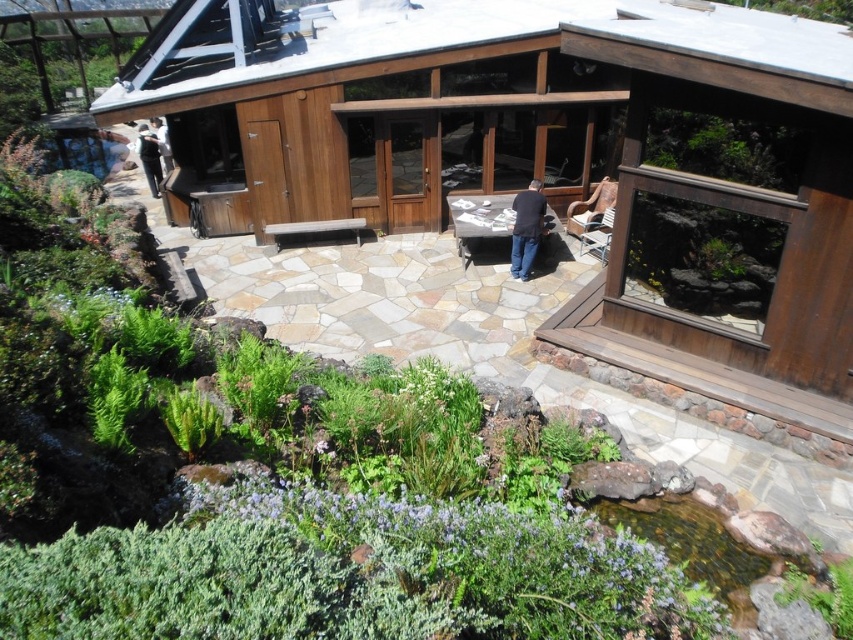
How distant is green mossy rock at lower left from dark blue jeans at left?

They are 4.55 meters apart.

How distant is green mossy rock at lower left from dark blue jeans at left?

The distance of green mossy rock at lower left from dark blue jeans at left is 4.55 meters.

Which is behind, point (61, 168) or point (148, 150)?

Positioned behind is point (61, 168).

Where is `green mossy rock at lower left`? The width and height of the screenshot is (853, 640). green mossy rock at lower left is located at coordinates click(83, 148).

Between green mossy rock at lower left and dark blue jeans at center, which one has more height?

green mossy rock at lower left

Who is more distant from viewer, (65, 161) or (524, 253)?

Point (65, 161)

Find the location of a particular element. green mossy rock at lower left is located at coordinates (83, 148).

You are a GUI agent. You are given a task and a screenshot of the screen. Output one action in this format:
    pyautogui.click(x=<x>, y=<y>)
    Task: Click on the green mossy rock at lower left
    
    Given the screenshot: What is the action you would take?
    pyautogui.click(x=83, y=148)

From the picture: Can you confirm if dark blue jeans at left is shorter than white fabric at left?

In fact, dark blue jeans at left may be taller than white fabric at left.

Which is behind, point (144, 147) or point (161, 156)?

Point (161, 156)

Find the location of a particular element. dark blue jeans at left is located at coordinates (x=149, y=157).